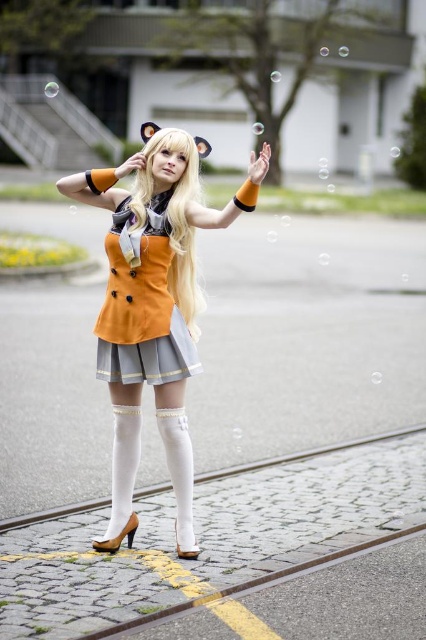
Question: Which is farther from the blonde silky hair at center?

Choices:
 (A) orange fabric dress at center
 (B) orange satin dress at center

Answer: (A)

Question: Can you confirm if orange fabric dress at center is positioned to the left of orange satin dress at center?

Choices:
 (A) yes
 (B) no

Answer: (B)

Question: Which is nearer to the orange satin dress at center?

Choices:
 (A) orange fabric dress at center
 (B) blonde silky hair at center

Answer: (A)

Question: Among these points, which one is nearest to the camera?

Choices:
 (A) (184, 305)
 (B) (123, 285)

Answer: (B)

Question: Considering the relative positions of orange fabric dress at center and blonde silky hair at center in the image provided, where is orange fabric dress at center located with respect to blonde silky hair at center?

Choices:
 (A) left
 (B) right

Answer: (A)

Question: Considering the relative positions of orange satin dress at center and blonde silky hair at center in the image provided, where is orange satin dress at center located with respect to blonde silky hair at center?

Choices:
 (A) right
 (B) left

Answer: (B)